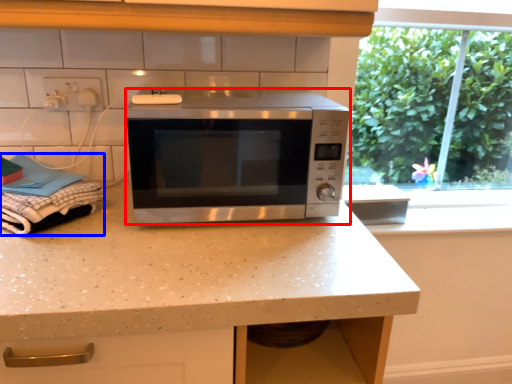
Question: Among these objects, which one is farthest to the camera, microwave oven (highlighted by a red box) or laundry (highlighted by a blue box)?

Choices:
 (A) microwave oven
 (B) laundry

Answer: (A)